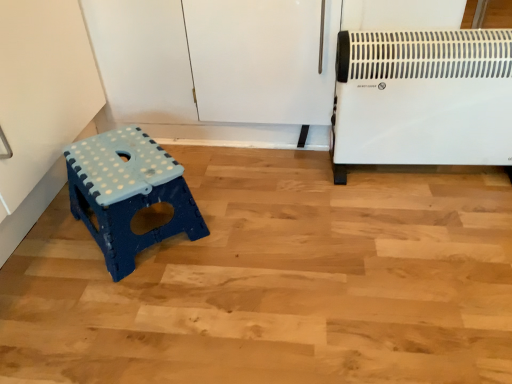
What do you see at coordinates (422, 98) in the screenshot? I see `white plastic heater at right` at bounding box center [422, 98].

The width and height of the screenshot is (512, 384). In order to click on white plastic heater at right in this screenshot , I will do [x=422, y=98].

Based on the photo, measure the distance between blue plastic stool at lower left and camera.

blue plastic stool at lower left and camera are 94.97 centimeters apart from each other.

At what (x,y) coordinates should I click in order to perform the action: click on blue plastic stool at lower left. Please return your answer as a coordinate pair (x, y). The width and height of the screenshot is (512, 384). Looking at the image, I should click on (128, 193).

Image resolution: width=512 pixels, height=384 pixels. Describe the element at coordinates (128, 193) in the screenshot. I see `blue plastic stool at lower left` at that location.

Locate an element on the screen. The height and width of the screenshot is (384, 512). white plastic heater at right is located at coordinates (422, 98).

Is blue plastic stool at lower left at the right side of white plastic heater at right?

No, blue plastic stool at lower left is not to the right of white plastic heater at right.

Which object is closer to the camera, blue plastic stool at lower left or white plastic heater at right?

blue plastic stool at lower left is closer to the camera.

Which is less distant, [91,173] or [340,152]?

Point [91,173] is positioned closer to the camera compared to point [340,152].

From the image's perspective, is blue plastic stool at lower left below white plastic heater at right?

Answer: Yes, from the image's perspective, blue plastic stool at lower left is below white plastic heater at right.

From a real-world perspective, relative to white plastic heater at right, is blue plastic stool at lower left vertically above or below?

blue plastic stool at lower left is below white plastic heater at right.

Between blue plastic stool at lower left and white plastic heater at right, which one has larger width?

Wider between the two is blue plastic stool at lower left.

Considering the sizes of objects blue plastic stool at lower left and white plastic heater at right in the image provided, who is taller, blue plastic stool at lower left or white plastic heater at right?

With more height is white plastic heater at right.

Which of these two, blue plastic stool at lower left or white plastic heater at right, is bigger?

With larger size is white plastic heater at right.

Is blue plastic stool at lower left not inside white plastic heater at right?

Absolutely, blue plastic stool at lower left is external to white plastic heater at right.

Is there a large distance between blue plastic stool at lower left and white plastic heater at right?

Actually, blue plastic stool at lower left and white plastic heater at right are a little close together.

Is blue plastic stool at lower left facing towards white plastic heater at right?

No, blue plastic stool at lower left does not turn towards white plastic heater at right.

How distant is blue plastic stool at lower left from white plastic heater at right?

66.08 centimeters.

Where is `furniture below the white plastic heater at right (from the image's perspective)`? The image size is (512, 384). furniture below the white plastic heater at right (from the image's perspective) is located at coordinates (128, 193).

Between white plastic heater at right and blue plastic stool at lower left, which one appears on the left side from the viewer's perspective?

From the viewer's perspective, blue plastic stool at lower left appears more on the left side.

In the image, is white plastic heater at right positioned in front of or behind blue plastic stool at lower left?

white plastic heater at right is behind blue plastic stool at lower left.

Does point (508, 148) come behind point (97, 167)?

Yes, it is.

From the image's perspective, would you say white plastic heater at right is positioned over blue plastic stool at lower left?

Yes, from the image's perspective, white plastic heater at right is above blue plastic stool at lower left.

From a real-world perspective, is white plastic heater at right physically located above or below blue plastic stool at lower left?

white plastic heater at right is situated higher than blue plastic stool at lower left in the real world.

Is white plastic heater at right wider or thinner than blue plastic stool at lower left?

In the image, white plastic heater at right appears to be more narrow than blue plastic stool at lower left.

Can you confirm if white plastic heater at right is shorter than blue plastic stool at lower left?

In fact, white plastic heater at right may be taller than blue plastic stool at lower left.

Is white plastic heater at right bigger or smaller than blue plastic stool at lower left?

Clearly, white plastic heater at right is larger in size than blue plastic stool at lower left.

Is white plastic heater at right outside of blue plastic stool at lower left?

white plastic heater at right is positioned outside blue plastic stool at lower left.

Is there a large distance between white plastic heater at right and blue plastic stool at lower left?

white plastic heater at right is near blue plastic stool at lower left, not far away.

Does white plastic heater at right turn towards blue plastic stool at lower left?

No, white plastic heater at right does not turn towards blue plastic stool at lower left.

How many degrees apart are the facing directions of white plastic heater at right and blue plastic stool at lower left?

white plastic heater at right and blue plastic stool at lower left are facing 41.4 degrees away from each other.

How far apart are white plastic heater at right and blue plastic stool at lower left?

A distance of 26.02 inches exists between white plastic heater at right and blue plastic stool at lower left.

At what (x,y) coordinates should I click in order to perform the action: click on furniture below the white plastic heater at right (from a real-world perspective). Please return your answer as a coordinate pair (x, y). Looking at the image, I should click on pos(128,193).

I want to click on furniture on the left of white plastic heater at right, so click(x=128, y=193).

The image size is (512, 384). In the image, there is a white plastic heater at right. In order to click on furniture below it (from a real-world perspective) in this screenshot , I will do coord(128,193).